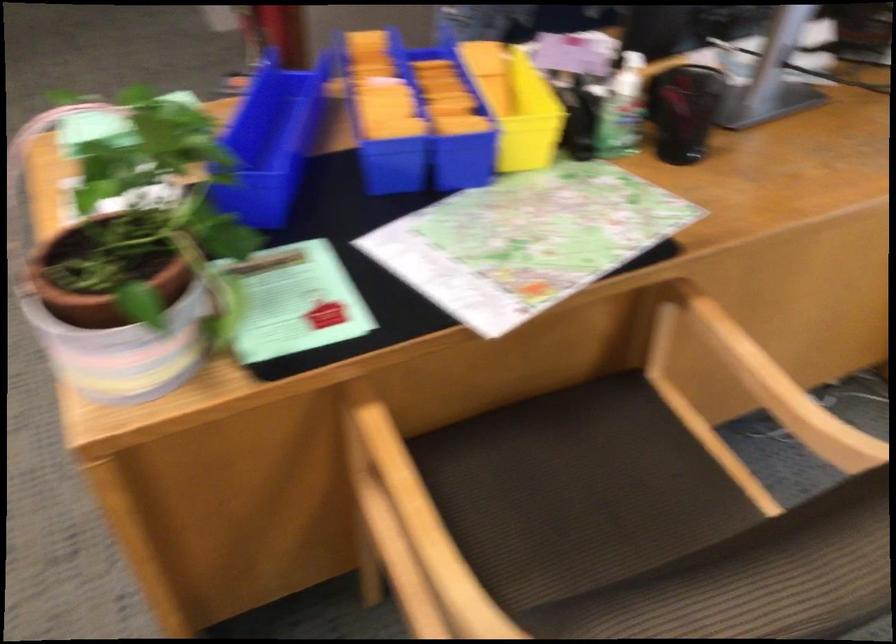
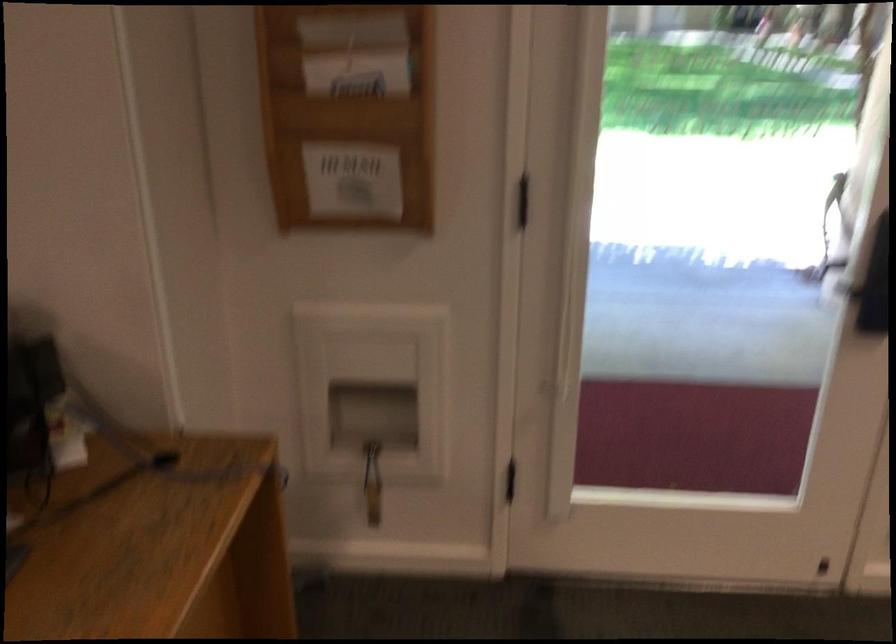
Question: The images are taken continuously from a first-person perspective. In which direction is your viewpoint rotating?

Choices:
 (A) Left
 (B) Right
 (C) Up
 (D) Down

Answer: (B)